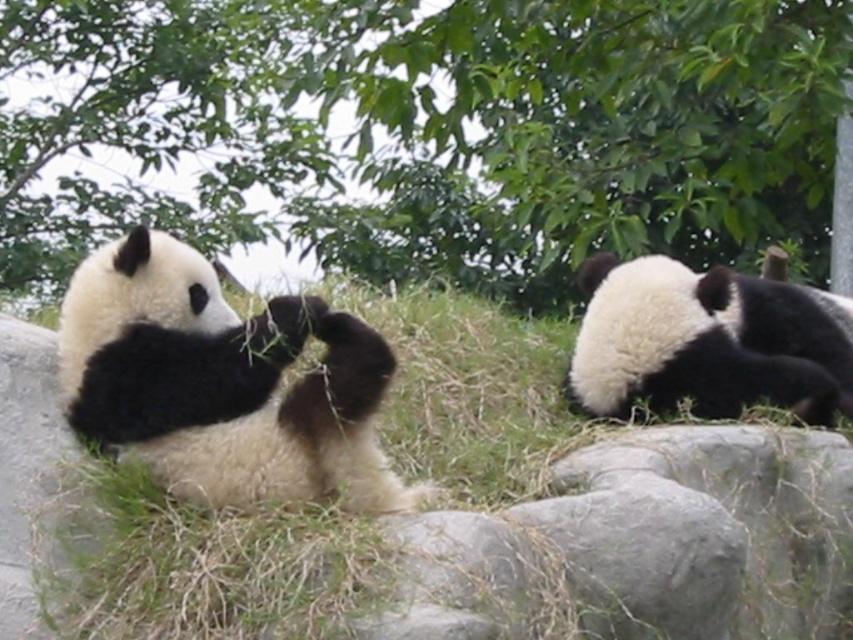
You are a zookeeper who needs to place a new feeding tray for the pandas. The tray must be placed between the green leafy tree at upper center and the green grass at center. Which object should the feeding tray be closer to so that it doesn

The feeding tray should be placed closer to the green grass at center because the green leafy tree at upper center is taller than the green grass at center, so the grass is lower and more accessible for the pandas to reach the tray.

You are a zookeeper who wants to ensure the pandas have enough space to move around. Based on the scene, can the black fuzzy panda at left move freely towards the green grass at center without any obstruction?

The green grass at center has a greater height compared to black fuzzy panda at left, so the black fuzzy panda at left can move freely towards the green grass at center since the grass height does not obstruct its movement.

You are a zookeeper observing the pandas in their enclosure. You need to determine which panda is taller between the black fuzzy panda at left and the black fur panda at upper right. Based on the scene, which one is taller?

The black fuzzy panda at left is taller than the black fur panda at upper right.